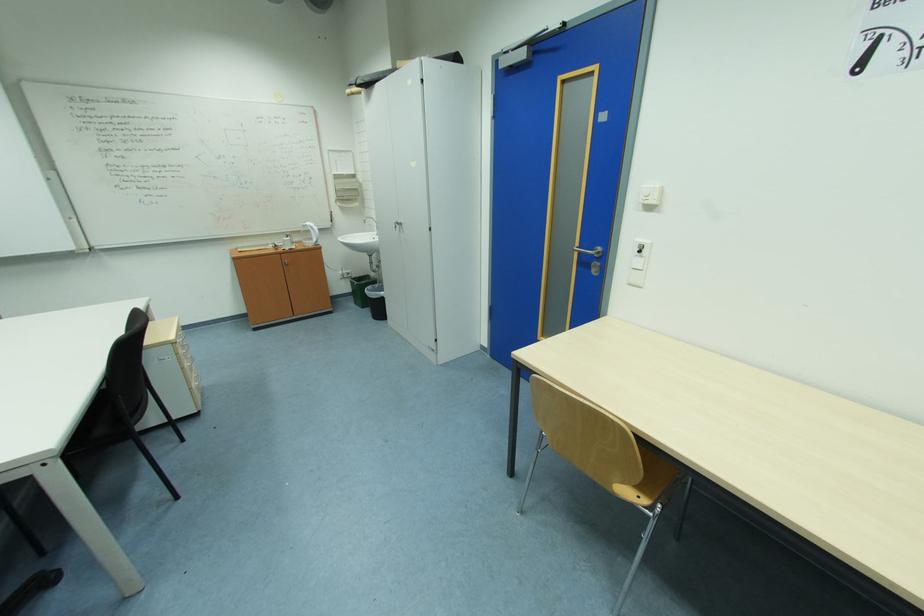
Find where to pull the white cabinet handle. Please return your answer as a coordinate pair (x, y).

(398, 225)